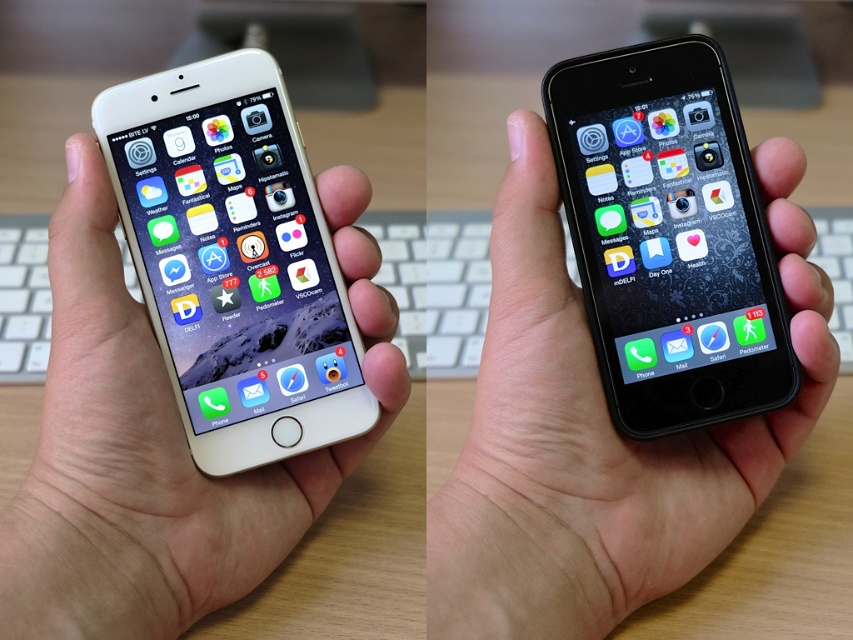
Is gold matte iphone at center positioned at the back of black matte smartphone at center?

That is False.

Is gold matte iphone at center smaller than black matte smartphone at center?

Actually, gold matte iphone at center might be larger than black matte smartphone at center.

Between point (44, 460) and point (671, 252), which one is positioned in front?

Point (44, 460)

At what (x,y) coordinates should I click in order to perform the action: click on gold matte iphone at center. Please return your answer as a coordinate pair (x, y). This screenshot has width=853, height=640. Looking at the image, I should click on (158, 445).

What do you see at coordinates (158, 445) in the screenshot? I see `gold matte iphone at center` at bounding box center [158, 445].

Which is more to the left, gold matte iphone at center or gold matte phone at left?

gold matte iphone at center

Is point (296, 486) less distant than point (148, 284)?

No, (296, 486) is behind (148, 284).

The height and width of the screenshot is (640, 853). What are the coordinates of `gold matte iphone at center` in the screenshot? It's located at (158, 445).

Can you confirm if black matte phone at center is smaller than black matte smartphone at center?

No, black matte phone at center is not smaller than black matte smartphone at center.

Is point (490, 340) less distant than point (596, 337)?

Yes, it is in front of point (596, 337).

The image size is (853, 640). In order to click on black matte phone at center in this screenshot , I will do `click(592, 436)`.